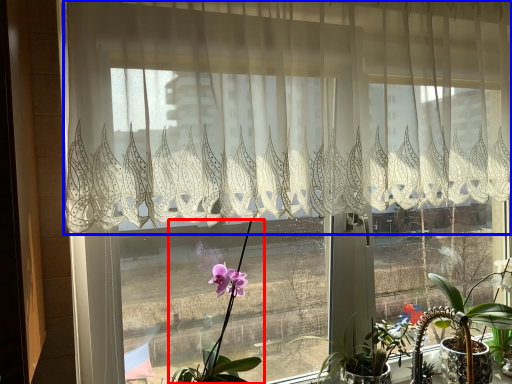
Question: Which object is closer to the camera taking this photo, houseplant (highlighted by a red box) or curtain (highlighted by a blue box)?

Choices:
 (A) houseplant
 (B) curtain

Answer: (B)